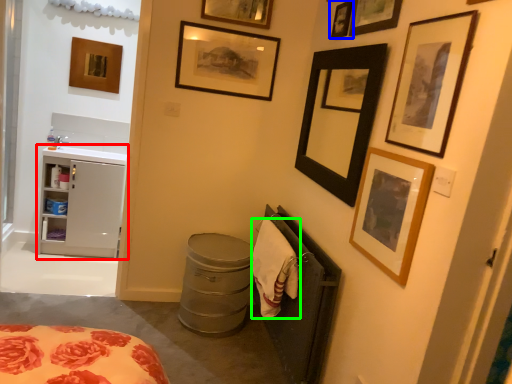
Question: Which object is the closest to the cabinetry (highlighted by a red box)? Choose among these: picture frame (highlighted by a blue box) or cloth (highlighted by a green box).

Choices:
 (A) picture frame
 (B) cloth

Answer: (B)